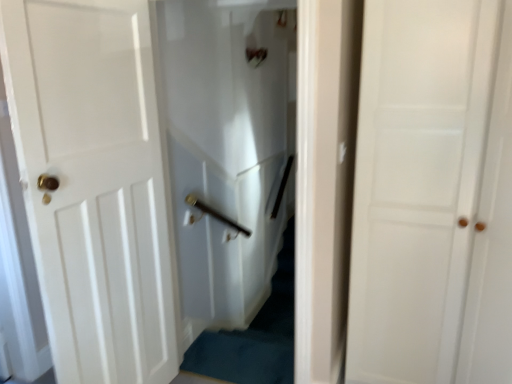
Question: Is white matte door at center, the 1th door in the right-to-left sequence, surrounding white glossy door at left, which appears as the 1th door when viewed from the left?

Choices:
 (A) no
 (B) yes

Answer: (A)

Question: Is white matte door at center, the 1th door in the right-to-left sequence, wider than white glossy door at left, which appears as the 1th door when viewed from the left?

Choices:
 (A) yes
 (B) no

Answer: (A)

Question: Is the position of white matte door at center, which appears as the second door when viewed from the left, more distant than that of white glossy door at left, which appears as the 1th door when viewed from the left?

Choices:
 (A) yes
 (B) no

Answer: (B)

Question: Is white matte door at center, which appears as the second door when viewed from the left, facing towards white glossy door at left, which appears as the 1th door when viewed from the left?

Choices:
 (A) no
 (B) yes

Answer: (A)

Question: Considering the relative sizes of white matte door at center, the 1th door in the right-to-left sequence, and white glossy door at left, the 2th door positioned from the right, in the image provided, is white matte door at center, the 1th door in the right-to-left sequence, shorter than white glossy door at left, the 2th door positioned from the right,?

Choices:
 (A) no
 (B) yes

Answer: (A)

Question: Is white matte door at center, which appears as the second door when viewed from the left, at the right side of white glossy door at left, which appears as the 1th door when viewed from the left?

Choices:
 (A) no
 (B) yes

Answer: (B)

Question: From the image's perspective, does white glossy door at left, which appears as the 1th door when viewed from the left, appear lower than white glossy elevator at center?

Choices:
 (A) yes
 (B) no

Answer: (A)

Question: Is white glossy door at left, the 2th door positioned from the right, bigger than white glossy elevator at center?

Choices:
 (A) yes
 (B) no

Answer: (A)

Question: From a real-world perspective, is white glossy door at left, which appears as the 1th door when viewed from the left, under white glossy elevator at center?

Choices:
 (A) no
 (B) yes

Answer: (B)

Question: Is white glossy door at left, which appears as the 1th door when viewed from the left, not close to white glossy elevator at center?

Choices:
 (A) yes
 (B) no

Answer: (B)

Question: Does white glossy door at left, which appears as the 1th door when viewed from the left, have a smaller size compared to white glossy elevator at center?

Choices:
 (A) no
 (B) yes

Answer: (A)

Question: From a real-world perspective, is white glossy door at left, which appears as the 1th door when viewed from the left, on white glossy elevator at center?

Choices:
 (A) no
 (B) yes

Answer: (A)

Question: Is white glossy elevator at center located outside white matte door at center, the 1th door in the right-to-left sequence?

Choices:
 (A) no
 (B) yes

Answer: (B)